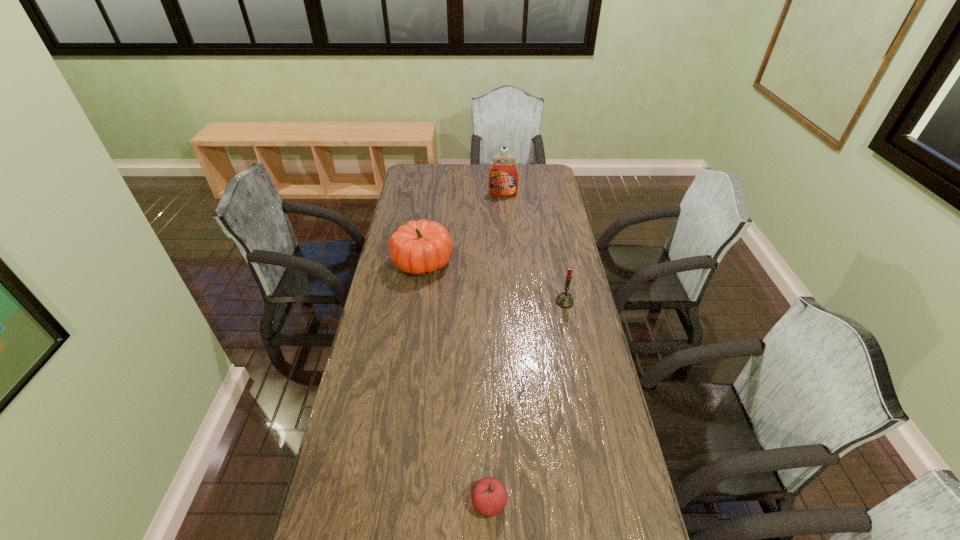
The width and height of the screenshot is (960, 540). I want to click on vacant point located between the pumpkin and the tallest object, so click(x=463, y=228).

Where is `free space between the nearest object and the leftmost object`? This screenshot has width=960, height=540. free space between the nearest object and the leftmost object is located at coordinates (456, 382).

Image resolution: width=960 pixels, height=540 pixels. What are the coordinates of `free space between the detergent and the rightmost object` in the screenshot? It's located at (534, 248).

Where is `empty space that is in between the tallest object and the nearest object`? The image size is (960, 540). empty space that is in between the tallest object and the nearest object is located at coordinates (496, 348).

Image resolution: width=960 pixels, height=540 pixels. I want to click on vacant point located between the tallest object and the rightmost object, so click(x=534, y=248).

What are the coordinates of `free spot between the detergent and the nearest object` in the screenshot? It's located at (496, 348).

Identify the location of vacant space that is in between the tallest object and the candle. (534, 248).

You are a GUI agent. You are given a task and a screenshot of the screen. Output one action in this format:
    pyautogui.click(x=<x>, y=<y>)
    Task: Click on the unoccupied area between the tomato and the third nearest object
    
    Given the screenshot: What is the action you would take?
    pyautogui.click(x=456, y=382)

At what (x,y) coordinates should I click in order to perform the action: click on object identified as the third closest to the shortest object. Please return your answer as a coordinate pair (x, y). This screenshot has height=540, width=960. Looking at the image, I should click on (503, 179).

Locate which object is the closest to the farthest object. Please provide its 2D coordinates. Your answer should be formatted as a tuple, i.e. [(x, y)], where the tuple contains the x and y coordinates of a point satisfying the conditions above.

[(421, 246)]